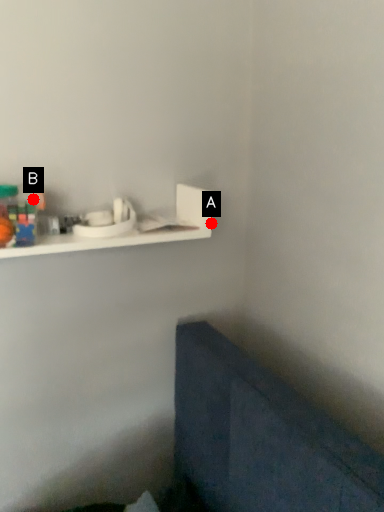
Question: Two points are circled on the image, labeled by A and B beside each circle. Which point is further to the camera?

Choices:
 (A) A is further
 (B) B is further

Answer: (A)